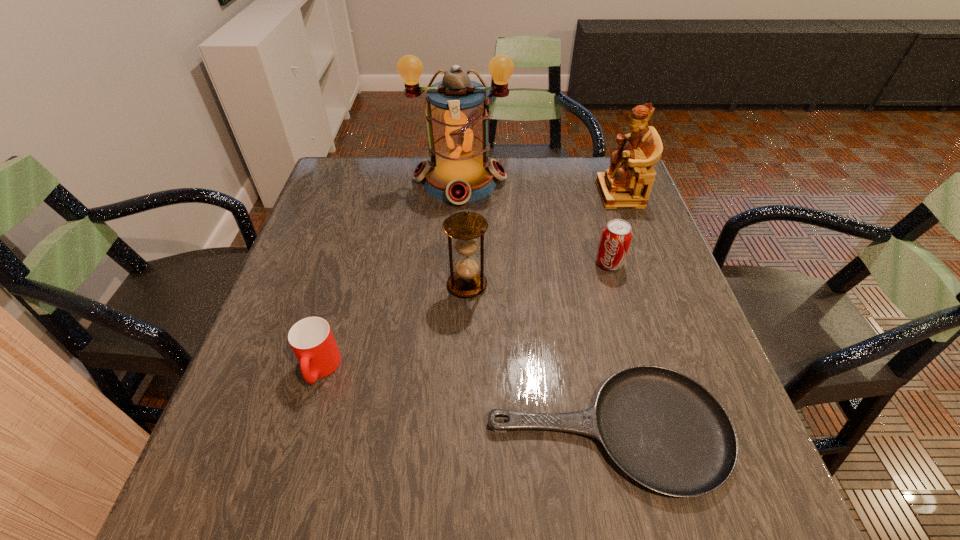
The height and width of the screenshot is (540, 960). What are the coordinates of `vacant area that satisfies the following two spatial constraints: 1. on the front-facing side of the second tallest object; 2. on the side of the leftmost object with the handle` in the screenshot? It's located at (685, 368).

Image resolution: width=960 pixels, height=540 pixels. Identify the location of vacant space that satisfies the following two spatial constraints: 1. on the front-facing side of the third shortest object; 2. on the left side of the lantern. (455, 263).

This screenshot has height=540, width=960. I want to click on free spot that satisfies the following two spatial constraints: 1. on the front-facing side of the fifth shortest object; 2. on the side of the cup with the handle, so click(685, 368).